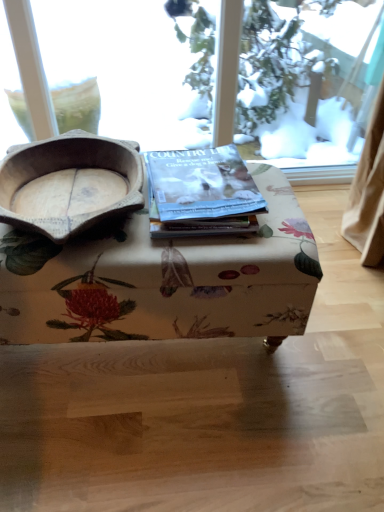
Where is `vacant area that is in front of floral fabric ottoman at center`? Image resolution: width=384 pixels, height=512 pixels. vacant area that is in front of floral fabric ottoman at center is located at coordinates (138, 438).